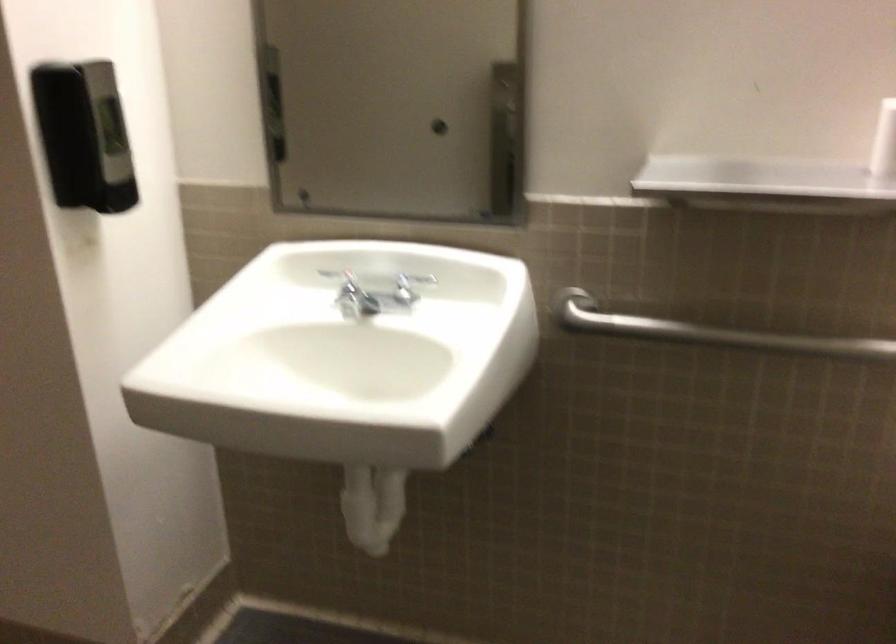
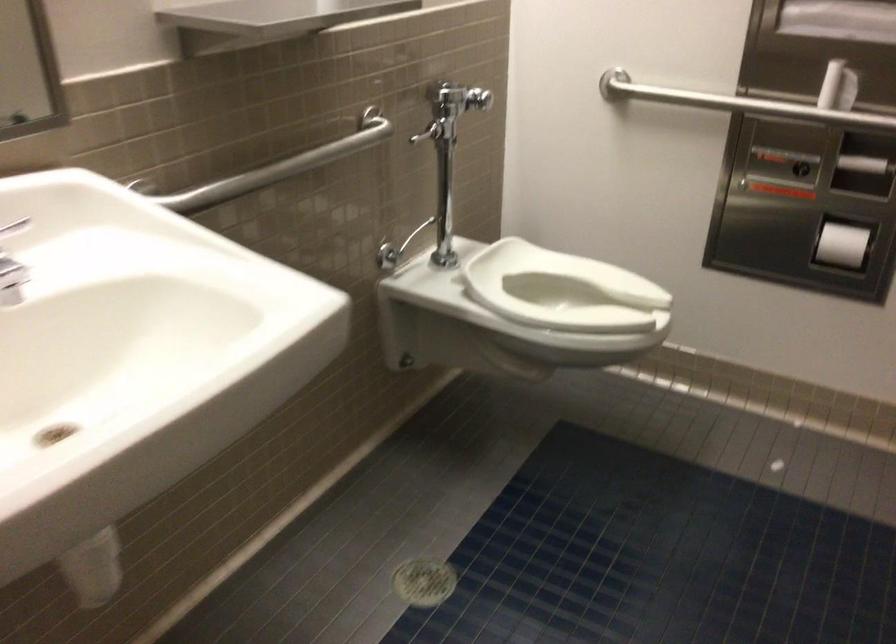
In the second image, find the point that corresponds to (718,330) in the first image.

(277, 167)